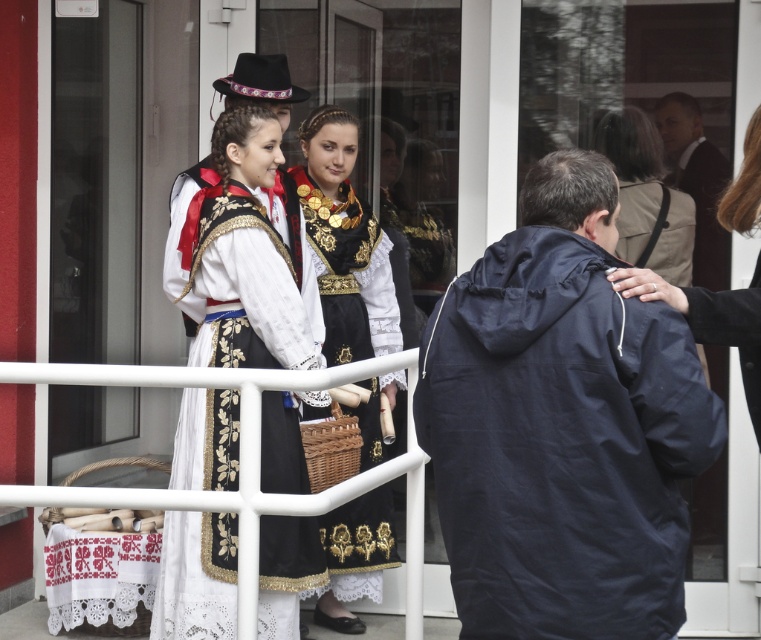
Does white lace dress at center have a lesser height compared to dark blue jacket at right?

No.

Is point (753, 392) positioned before point (718, 244)?

That is True.

The image size is (761, 640). I want to click on white lace dress at center, so click(x=712, y=320).

Is point (756, 426) in front of point (658, 180)?

Yes, it is in front of point (658, 180).

Image resolution: width=761 pixels, height=640 pixels. Describe the element at coordinates (712, 320) in the screenshot. I see `white lace dress at center` at that location.

Which is in front, point (623, 276) or point (632, 170)?

Point (623, 276) is more forward.

Where is `white lace dress at center`? This screenshot has width=761, height=640. white lace dress at center is located at coordinates (712, 320).

The height and width of the screenshot is (640, 761). Describe the element at coordinates (344, 241) in the screenshot. I see `black satin dress at center` at that location.

Which of these two, black satin dress at center or dark blue jacket at right, stands taller?

black satin dress at center

Does point (361, 428) come in front of point (670, 161)?

Yes.

Find the location of a particular element. black satin dress at center is located at coordinates (344, 241).